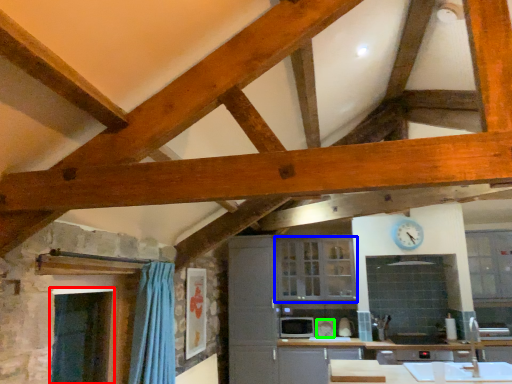
Question: Estimate the real-world distances between objects in this image. Which object is farther from window screen (highlighted by a red box), cabinetry (highlighted by a blue box) or appliance (highlighted by a green box)?

Choices:
 (A) cabinetry
 (B) appliance

Answer: (B)